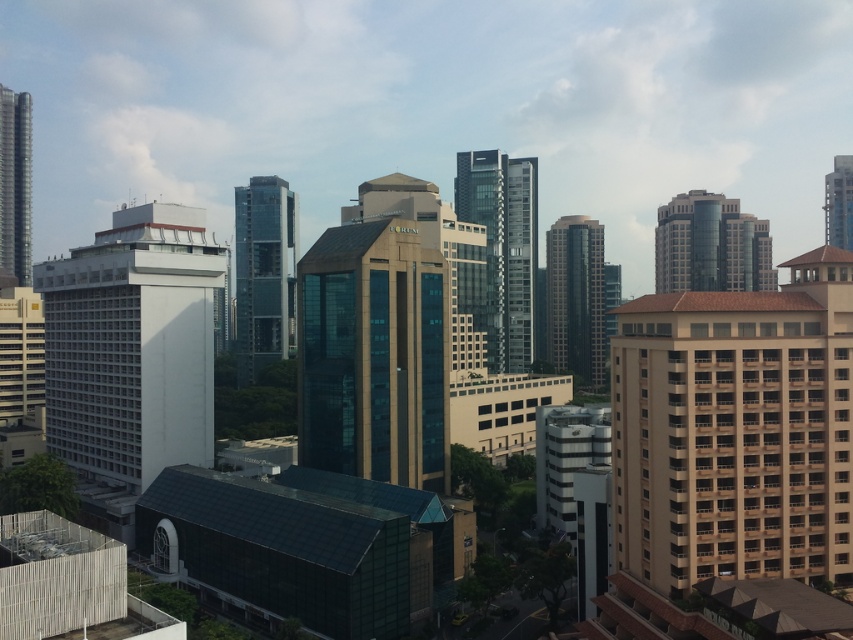
This screenshot has width=853, height=640. I want to click on white matte building at left, so click(x=131, y=355).

Can you confirm if white matte building at left is positioned above glassy steel skyscraper at center?

Incorrect, white matte building at left is not positioned above glassy steel skyscraper at center.

Where is `white matte building at left`? white matte building at left is located at coordinates (131, 355).

Between beige concrete building at right and white matte building at left, which one has less height?

Standing shorter between the two is beige concrete building at right.

Between beige concrete building at right and white matte building at left, which one appears on the left side from the viewer's perspective?

white matte building at left is more to the left.

This screenshot has height=640, width=853. Identify the location of beige concrete building at right. [735, 429].

Does glassy steel skyscraper at center have a lesser height compared to shiny metallic skyscraper at left?

Incorrect, glassy steel skyscraper at center's height does not fall short of shiny metallic skyscraper at left's.

Can you confirm if glassy steel skyscraper at center is bigger than shiny metallic skyscraper at left?

Incorrect, glassy steel skyscraper at center is not larger than shiny metallic skyscraper at left.

I want to click on glassy steel skyscraper at center, so click(503, 248).

Find the location of a particular element. This screenshot has width=853, height=640. glassy steel skyscraper at center is located at coordinates (503, 248).